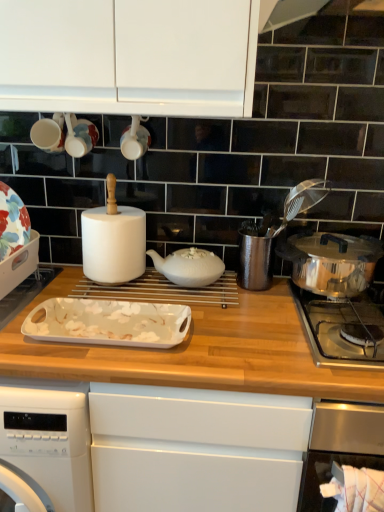
Question: Is point (311, 241) closer or farther from the camera than point (360, 300)?

Choices:
 (A) closer
 (B) farther

Answer: (B)

Question: In the image, is polished stainless steel pot at right, arranged as the first kitchen appliance when viewed from the right, on the left side or the right side of polished stainless steel pot at right?

Choices:
 (A) left
 (B) right

Answer: (A)

Question: Estimate the real-world distances between objects in this image. Which object is farther from the white glossy tray at left, the 3th kitchen appliance in the right-to-left sequence?

Choices:
 (A) white ceramic teapot at center
 (B) polished stainless steel pot at right
 (C) polished stainless steel pot at right, placed as the third kitchen appliance when sorted from left to right
 (D) white glossy cup at upper center
 (E) white glossy tray at center, which is the second kitchen appliance in right-to-left order

Answer: (C)

Question: Which object is the closest to the polished stainless steel pot at right?

Choices:
 (A) white glossy tray at left, the 3th kitchen appliance in the right-to-left sequence
 (B) white glossy cup at upper center
 (C) white ceramic teapot at center
 (D) white glossy tray at center, which is the second kitchen appliance in right-to-left order
 (E) polished stainless steel pot at right, arranged as the first kitchen appliance when viewed from the right

Answer: (E)